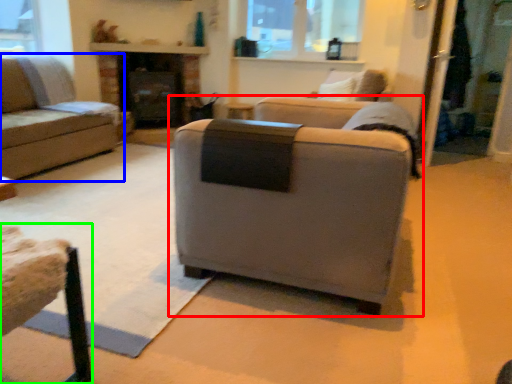
Question: Which object is the closest to the studio couch (highlighted by a red box)? Choose among these: studio couch (highlighted by a blue box) or swivel chair (highlighted by a green box).

Choices:
 (A) studio couch
 (B) swivel chair

Answer: (B)